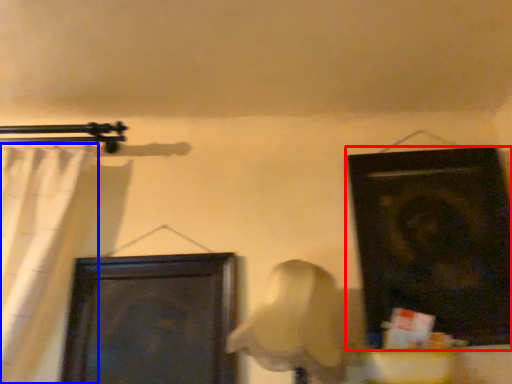
Question: Which point is closer to the camera, door (highlighted by a red box) or curtain (highlighted by a blue box)?

Choices:
 (A) door
 (B) curtain

Answer: (B)